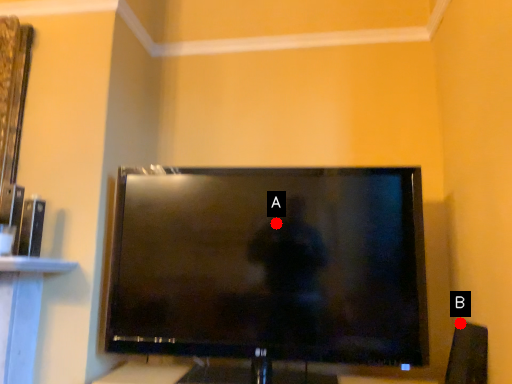
Question: Two points are circled on the image, labeled by A and B beside each circle. Which of the following is the closest to the observer?

Choices:
 (A) A is closer
 (B) B is closer

Answer: (A)